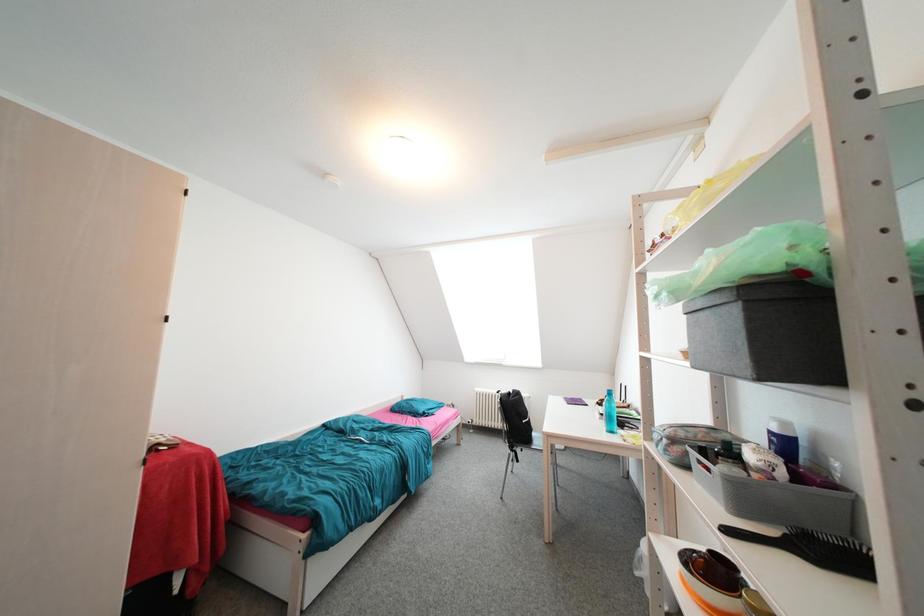
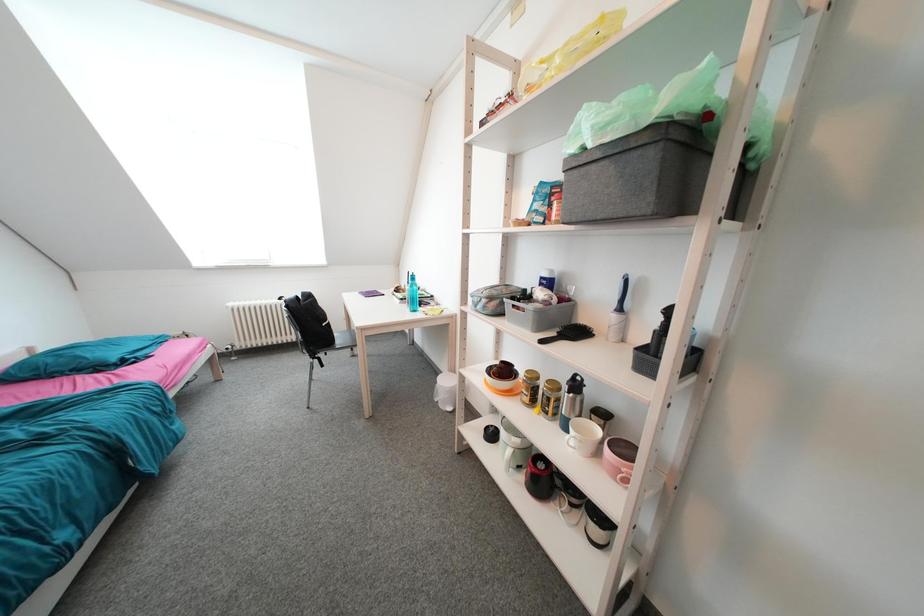
The images are taken continuously from a first-person perspective. In which direction is your viewpoint rotating?

The rotation direction of the camera is right-down.